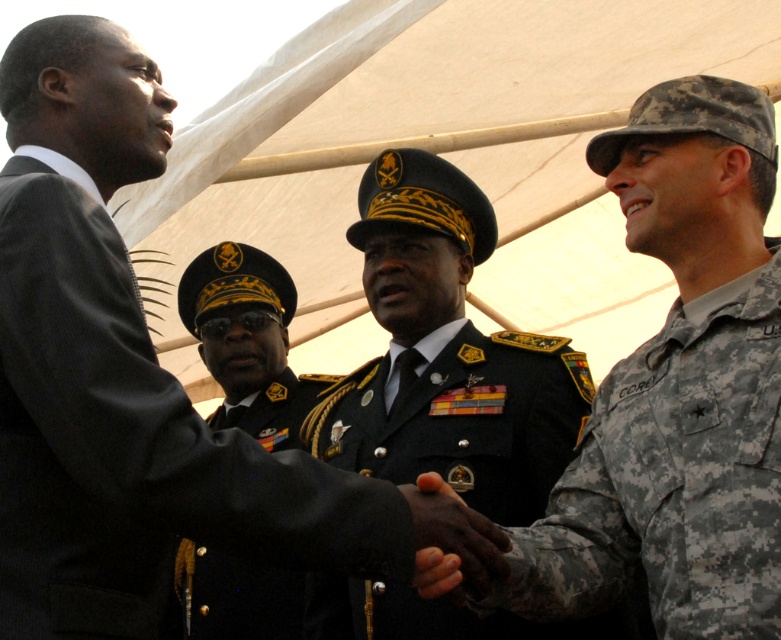
Question: Is dark gray suit at left closer to the viewer compared to black uniform at center?

Choices:
 (A) no
 (B) yes

Answer: (B)

Question: Which point is farther from the camera taking this photo?

Choices:
 (A) (223, 244)
 (B) (767, 333)
 (C) (366, 410)

Answer: (A)

Question: Estimate the real-world distances between objects in this image. Which object is closer to the black uniform at center?

Choices:
 (A) black/golden-metallic military uniform at center
 (B) camouflage uniform at right

Answer: (A)

Question: Does camouflage uniform at right lie behind black/golden-metallic military uniform at center?

Choices:
 (A) yes
 (B) no

Answer: (B)

Question: Which point is closer to the camera?

Choices:
 (A) (503, 538)
 (B) (553, 436)
 (C) (562, 556)

Answer: (A)

Question: Considering the relative positions of black uniform at center and dark skin/dryhand at center in the image provided, where is black uniform at center located with respect to dark skin/dryhand at center?

Choices:
 (A) above
 (B) below

Answer: (A)